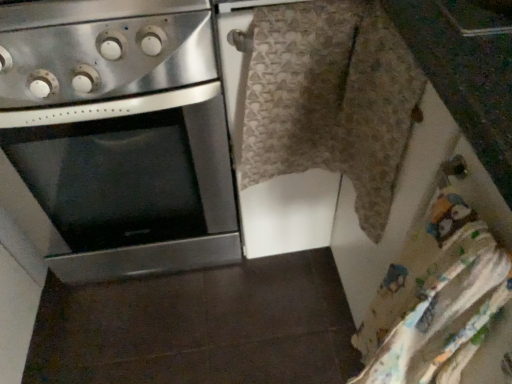
Question: Considering the positions of stainless steel oven at left and stainless steel gas stove at upper left in the image, is stainless steel oven at left bigger or smaller than stainless steel gas stove at upper left?

Choices:
 (A) big
 (B) small

Answer: (A)

Question: Does point (102, 59) appear closer or farther from the camera than point (134, 62)?

Choices:
 (A) farther
 (B) closer

Answer: (B)

Question: Estimate the real-world distances between objects in this image. Which object is closer to the stainless steel oven at left?

Choices:
 (A) textured beige blanket at center
 (B) stainless steel gas stove at upper left

Answer: (B)

Question: Which object is positioned closest to the stainless steel gas stove at upper left?

Choices:
 (A) textured beige blanket at center
 (B) stainless steel oven at left

Answer: (B)